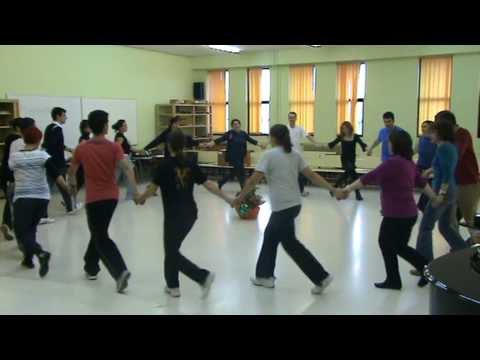
The image size is (480, 360). What are the coordinates of `floor` in the screenshot? It's located at (230, 264).